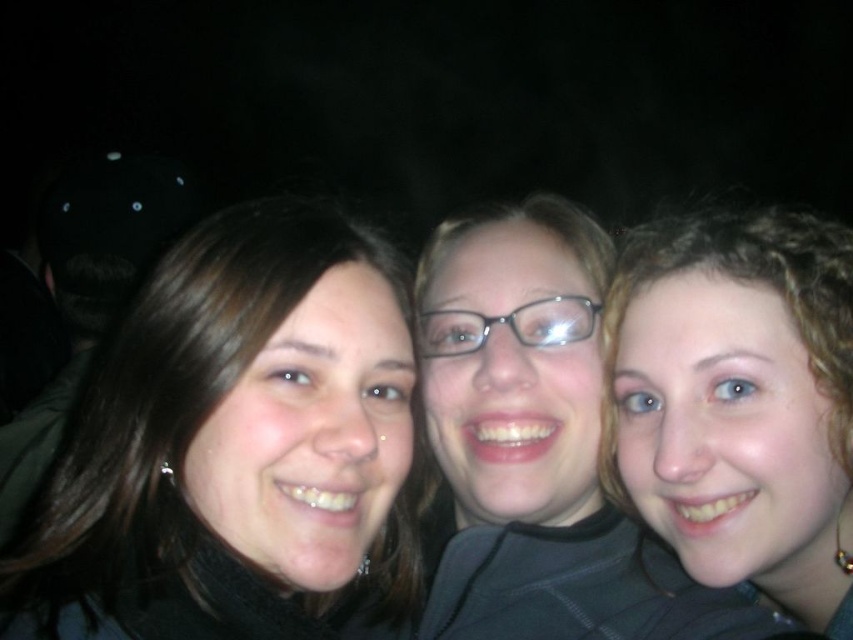
Question: Among these objects, which one is farthest from the camera?

Choices:
 (A) matte black glasses at center
 (B) matte black hair at left
 (C) curly hair at right

Answer: (A)

Question: Can you confirm if matte black hair at left is positioned above matte black glasses at center?

Choices:
 (A) no
 (B) yes

Answer: (A)

Question: Does matte black hair at left have a greater width compared to matte black glasses at center?

Choices:
 (A) no
 (B) yes

Answer: (B)

Question: Among these objects, which one is farthest from the camera?

Choices:
 (A) curly hair at right
 (B) matte black glasses at center
 (C) matte black hair at left

Answer: (B)

Question: Is curly hair at right bigger than matte black glasses at center?

Choices:
 (A) no
 (B) yes

Answer: (B)

Question: Which point is closer to the camera taking this photo?

Choices:
 (A) (733, 426)
 (B) (271, 417)

Answer: (B)